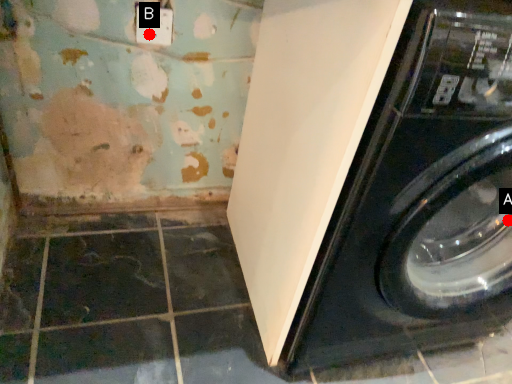
Question: Two points are circled on the image, labeled by A and B beside each circle. Which point appears closest to the camera in this image?

Choices:
 (A) A is closer
 (B) B is closer

Answer: (A)